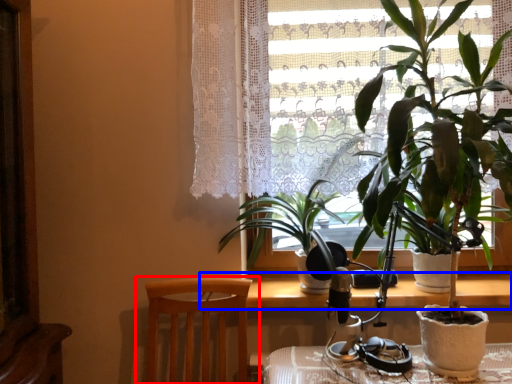
Question: Which of the following is the farthest to the observer, chair (highlighted by a red box) or table (highlighted by a blue box)?

Choices:
 (A) chair
 (B) table

Answer: (B)